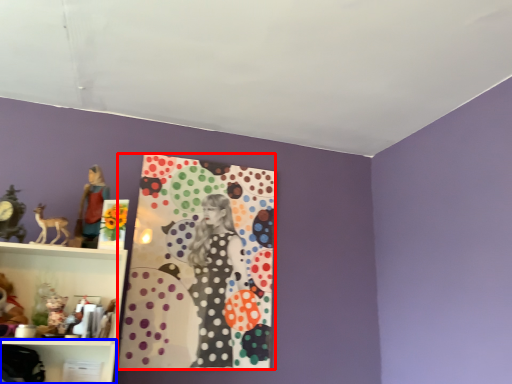
Question: Which object appears farthest to the camera in this image, design (highlighted by a red box) or shelf (highlighted by a blue box)?

Choices:
 (A) design
 (B) shelf

Answer: (A)